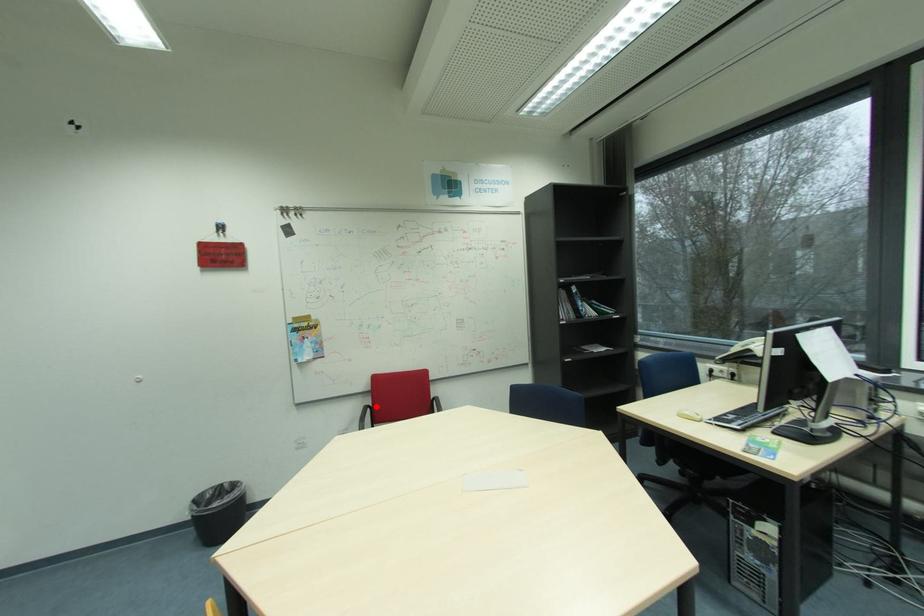
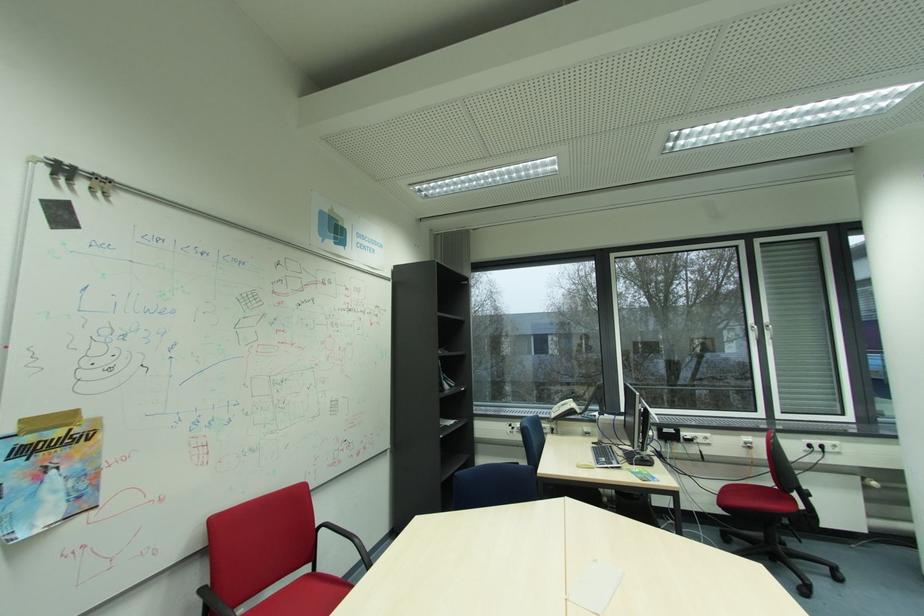
Question: I am providing you with two images of the same scene from different viewpoints. A red point is shown in image1. For the corresponding object point in image2, is it positioned nearer or farther from the camera?

Choices:
 (A) Nearer
 (B) Farther

Answer: (A)